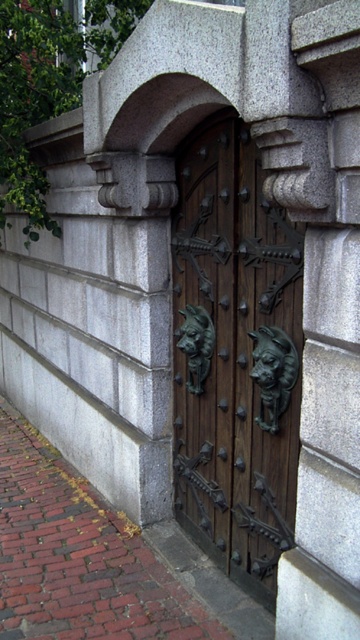
Question: Which of the following is the closest to the observer?

Choices:
 (A) (28, 566)
 (B) (218, 513)

Answer: (B)

Question: Is wooden door with metal accents at center bigger than brick pavement at lower left?

Choices:
 (A) no
 (B) yes

Answer: (A)

Question: Does wooden door with metal accents at center come in front of brick pavement at lower left?

Choices:
 (A) no
 (B) yes

Answer: (B)

Question: Observing the image, what is the correct spatial positioning of wooden door with metal accents at center in reference to brick pavement at lower left?

Choices:
 (A) below
 (B) above

Answer: (B)

Question: Among these points, which one is farthest from the camera?

Choices:
 (A) (20, 486)
 (B) (218, 172)

Answer: (A)